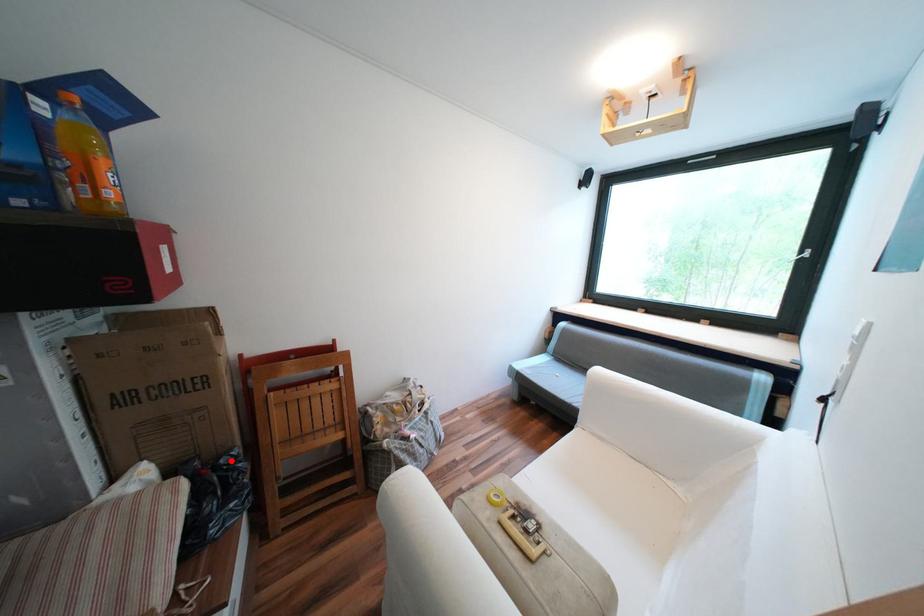
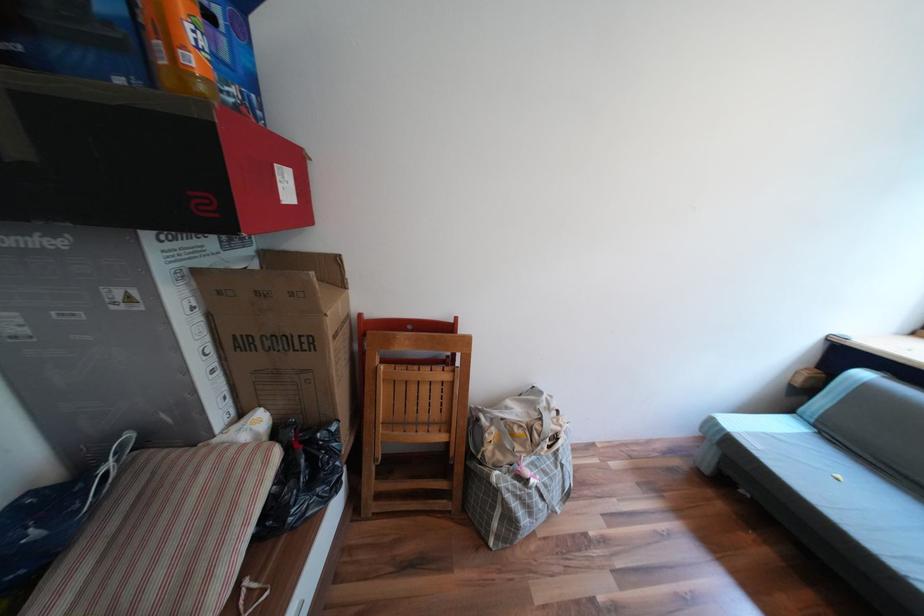
Question: I am providing you with two images of the same scene from different viewpoints. A red point is shown in image1. For the corresponding object point in image2, is it positioned nearer or farther from the camera?

Choices:
 (A) Nearer
 (B) Farther

Answer: (A)